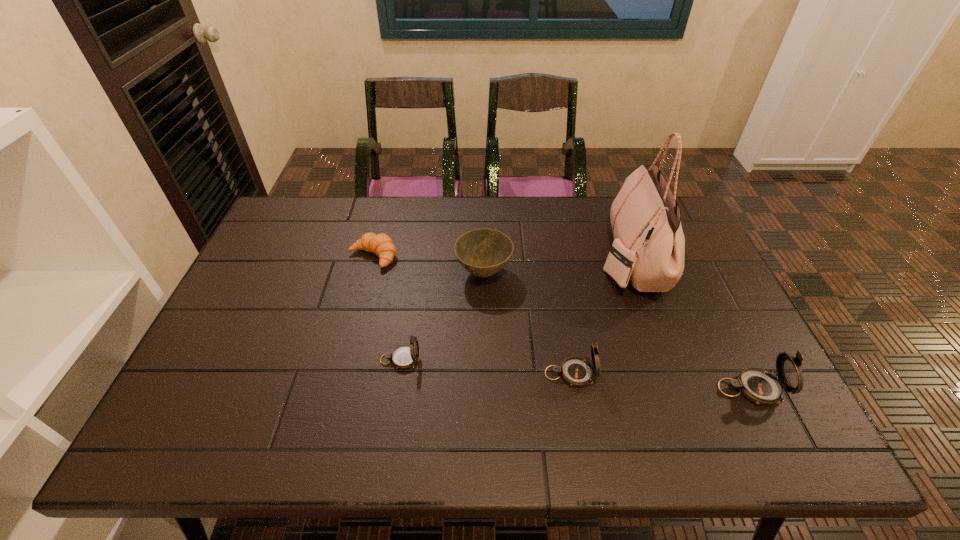
What are the coordinates of `the second object from left to right` in the screenshot? It's located at (x=405, y=357).

Identify the location of the shortest compass. The image size is (960, 540). (405, 357).

Locate an element on the screen. The image size is (960, 540). the second compass from left to right is located at coordinates (576, 371).

The width and height of the screenshot is (960, 540). I want to click on the third object from right to left, so click(x=576, y=371).

Where is `the rightmost object`? The width and height of the screenshot is (960, 540). the rightmost object is located at coordinates (758, 385).

The height and width of the screenshot is (540, 960). What are the coordinates of `the tallest compass` in the screenshot? It's located at (758, 385).

The height and width of the screenshot is (540, 960). What are the coordinates of `the third object from left to right` in the screenshot? It's located at (483, 252).

I want to click on handbag, so point(649,245).

Locate an element on the screen. the fifth object from left to right is located at coordinates (649, 245).

You are a GUI agent. You are given a task and a screenshot of the screen. Output one action in this format:
    pyautogui.click(x=<x>, y=<y>)
    Task: Click on the crescent roll
    The width and height of the screenshot is (960, 540).
    Given the screenshot: What is the action you would take?
    pyautogui.click(x=381, y=244)